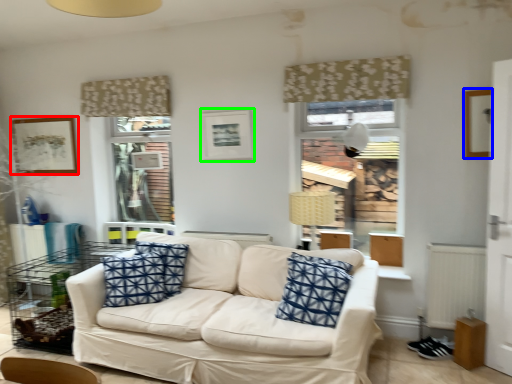
Question: Considering the real-world distances, which object is farthest from picture frame (highlighted by a red box)? picture frame (highlighted by a blue box) or picture frame (highlighted by a green box)?

Choices:
 (A) picture frame
 (B) picture frame

Answer: (A)